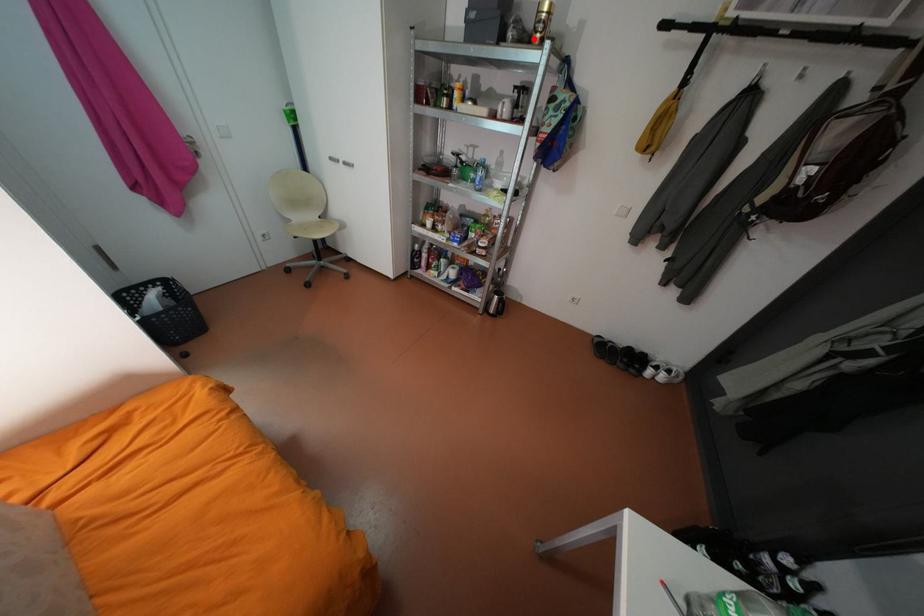
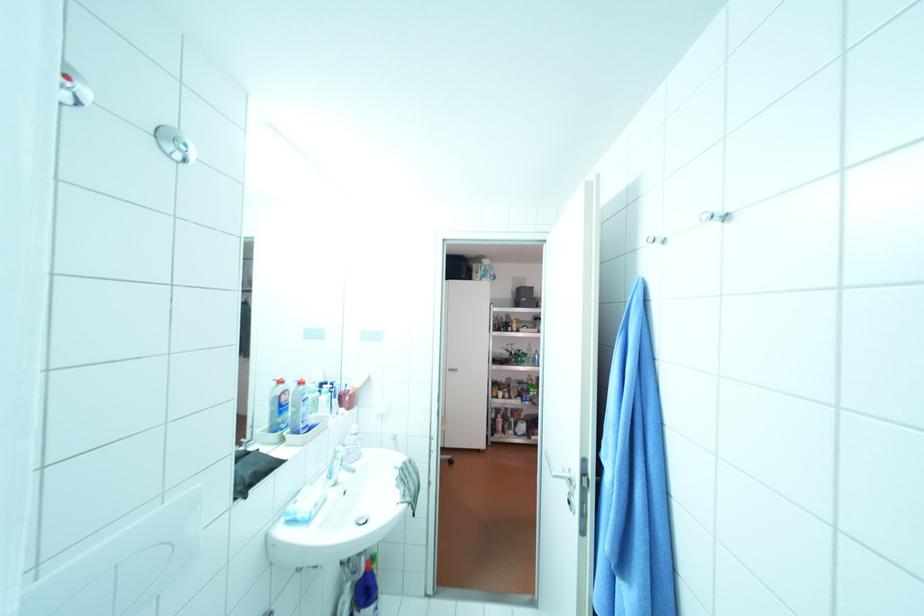
Question: I am providing you with two images of the same scene from different viewpoints. A red point is marked on the first image. Can you still see the location of the red point in image 2?

Choices:
 (A) Yes
 (B) No

Answer: (B)